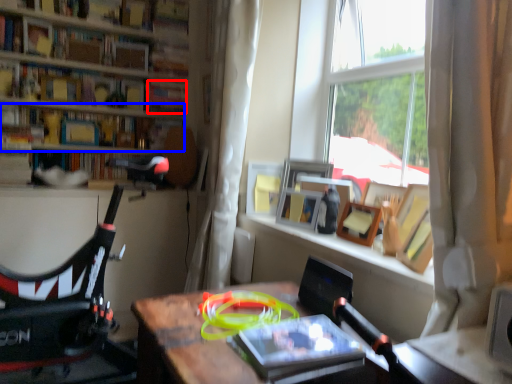
Question: Among these objects, which one is nearest to the camera, book (highlighted by a red box) or book (highlighted by a blue box)?

Choices:
 (A) book
 (B) book

Answer: (B)